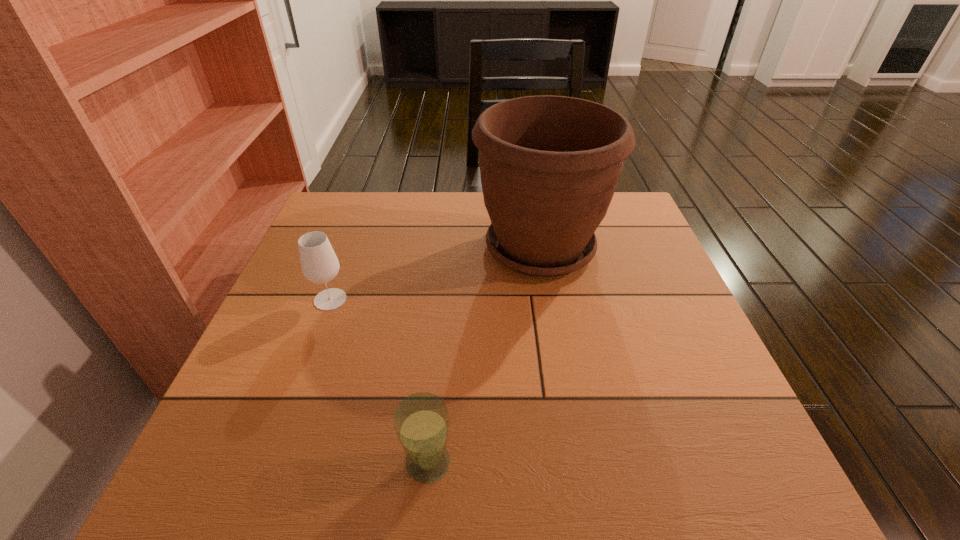
Find the location of a particular element. The image size is (960, 540). flowerpot is located at coordinates (549, 165).

Find the location of a particular element. This screenshot has height=540, width=960. the rightmost object is located at coordinates 549,165.

The height and width of the screenshot is (540, 960). Identify the location of the taller glass. (319, 263).

Identify the location of the farther glass. (319, 263).

Where is `the nearer glass`? The width and height of the screenshot is (960, 540). the nearer glass is located at coordinates (421, 421).

Where is `the shorter glass`? This screenshot has height=540, width=960. the shorter glass is located at coordinates (421, 421).

This screenshot has height=540, width=960. Identify the location of vacant area situated 0.210m on the left of the tallest object. (394, 248).

At what (x,y) coordinates should I click in order to perform the action: click on free region located on the front of the second shortest object. Please return your answer as a coordinate pair (x, y). The height and width of the screenshot is (540, 960). Looking at the image, I should click on (286, 420).

At what (x,y) coordinates should I click in order to perform the action: click on free location located on the right of the second object from right to left. Please return your answer as a coordinate pair (x, y). Image resolution: width=960 pixels, height=540 pixels. Looking at the image, I should click on (679, 462).

Locate an element on the screen. This screenshot has width=960, height=540. object present at the far edge is located at coordinates (549, 165).